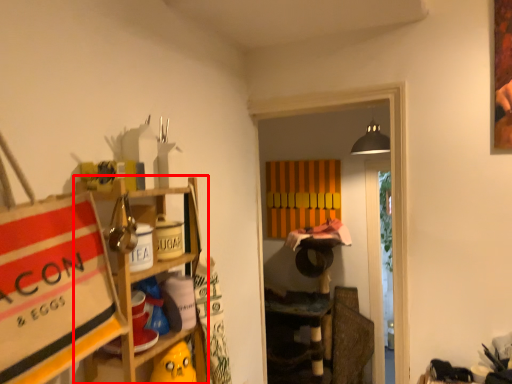
Question: From the image, what is the correct spatial relationship of shelf (annotated by the red box) in relation to cabinet?

Choices:
 (A) left
 (B) right

Answer: (A)